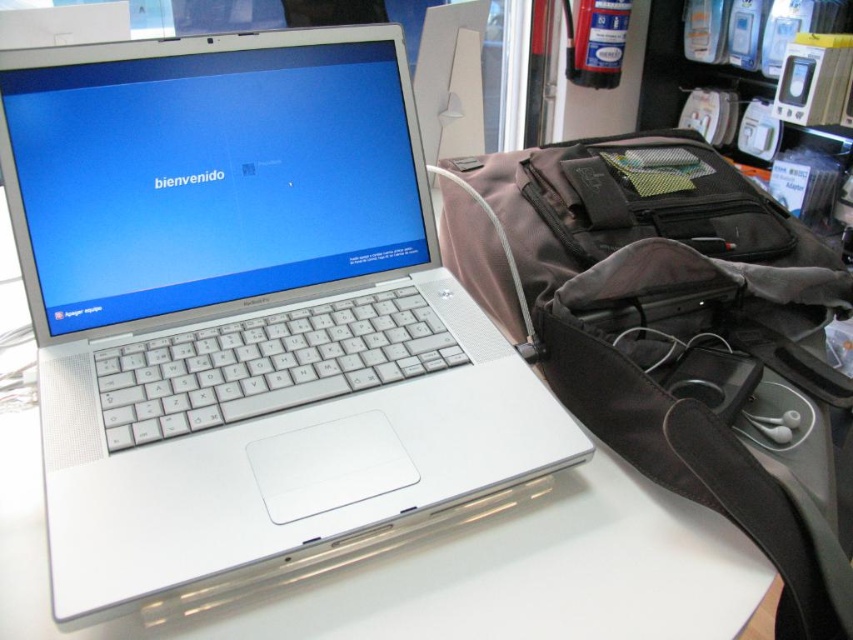
This screenshot has height=640, width=853. Describe the element at coordinates (245, 310) in the screenshot. I see `silver metallic laptop at center` at that location.

Can you confirm if silver metallic laptop at center is thinner than gray fabric backpack at right?

No.

This screenshot has width=853, height=640. In order to click on silver metallic laptop at center in this screenshot , I will do `click(245, 310)`.